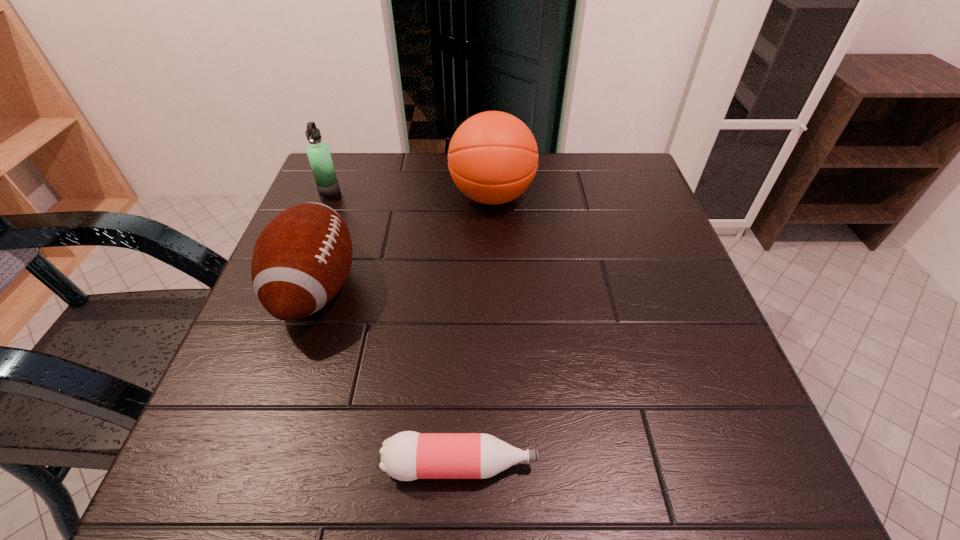
The width and height of the screenshot is (960, 540). I want to click on thermos bottle that is at the far edge, so click(x=318, y=152).

Find the location of a particular element. This screenshot has width=960, height=540. object located at the near edge is located at coordinates (406, 456).

I want to click on thermos bottle that is at the left edge, so click(318, 152).

Locate an element on the screen. football that is at the left edge is located at coordinates (301, 259).

In order to click on object that is at the far left corner in this screenshot , I will do `click(318, 152)`.

Identify the location of blank space at the far edge of the desktop. (412, 194).

Find the location of `vacant area at the near edge`. vacant area at the near edge is located at coordinates (337, 438).

The image size is (960, 540). What are the coordinates of `vacant space at the left edge of the desktop` in the screenshot? It's located at (225, 411).

This screenshot has width=960, height=540. Identify the location of free space at the right edge of the desktop. (650, 244).

Image resolution: width=960 pixels, height=540 pixels. I want to click on vacant space at the far left corner, so click(x=352, y=185).